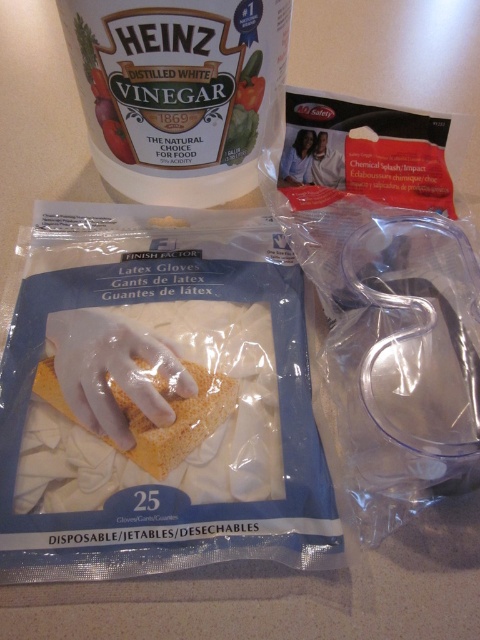
Question: Does white plastic container at upper left have a lesser width compared to yellow sponge at center?

Choices:
 (A) yes
 (B) no

Answer: (B)

Question: Among these points, which one is farthest from the camera?

Choices:
 (A) (212, 164)
 (B) (178, 438)

Answer: (A)

Question: Which point appears farthest from the camera in this image?

Choices:
 (A) (262, 4)
 (B) (188, 442)

Answer: (A)

Question: Where is white plastic container at upper left located in relation to yellow sponge at center in the image?

Choices:
 (A) above
 (B) below

Answer: (A)

Question: Can you confirm if white plastic container at upper left is thinner than yellow sponge at center?

Choices:
 (A) yes
 (B) no

Answer: (B)